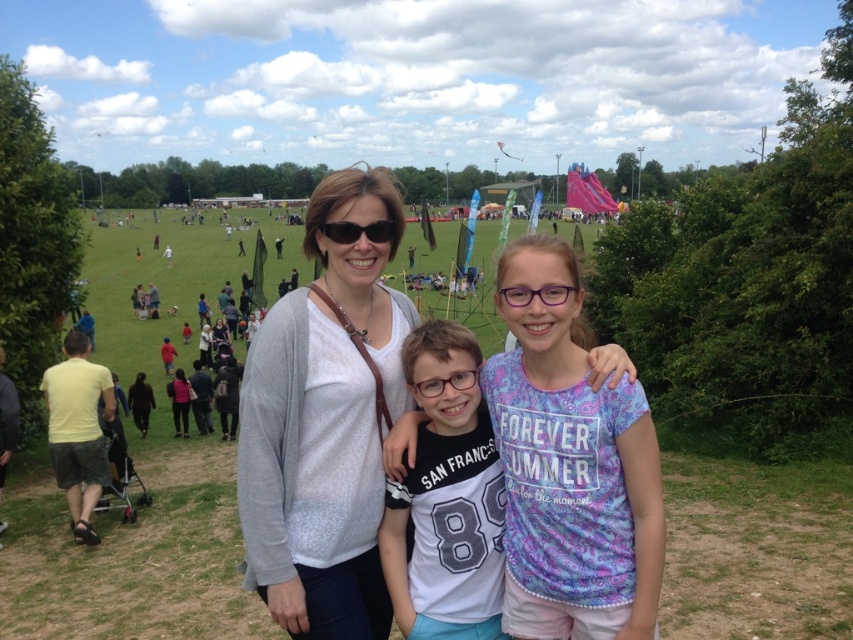
Question: Is gray sweater at center to the right of white jersey at center from the viewer's perspective?

Choices:
 (A) yes
 (B) no

Answer: (B)

Question: Can you confirm if white cotton shirt at center is bigger than black plastic sunglasses at center?

Choices:
 (A) no
 (B) yes

Answer: (B)

Question: Which object is positioned closest to the white jersey at center?

Choices:
 (A) clear plastic glasses at center
 (B) gray sweater at center
 (C) black plastic sunglasses at center

Answer: (A)

Question: Among these points, which one is farthest from the camera?

Choices:
 (A) (267, 492)
 (B) (442, 387)
 (C) (332, 221)

Answer: (C)

Question: Which point is closer to the camera?

Choices:
 (A) purple plastic glasses at center
 (B) black plastic sunglasses at center

Answer: (A)

Question: Does white cotton shirt at center appear on the left side of white jersey at center?

Choices:
 (A) yes
 (B) no

Answer: (B)